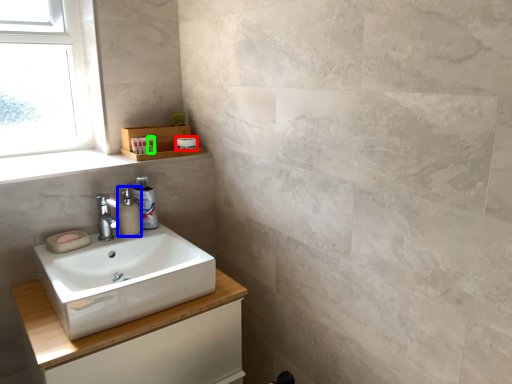
Question: Based on their relative distances, which object is farther from toilet paper (highlighted by a red box)? Choose from soap dispenser (highlighted by a blue box) and toiletry (highlighted by a green box).

Choices:
 (A) soap dispenser
 (B) toiletry

Answer: (A)